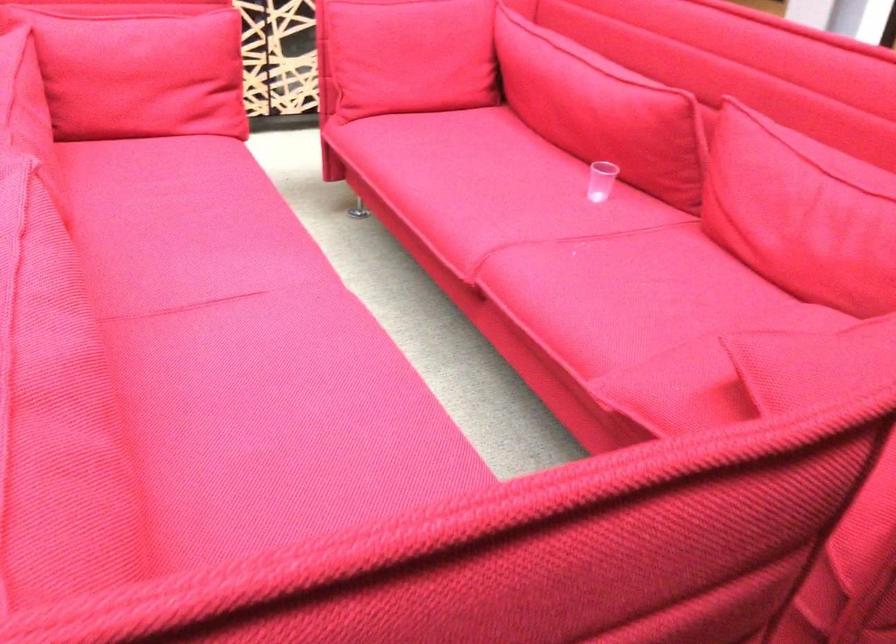
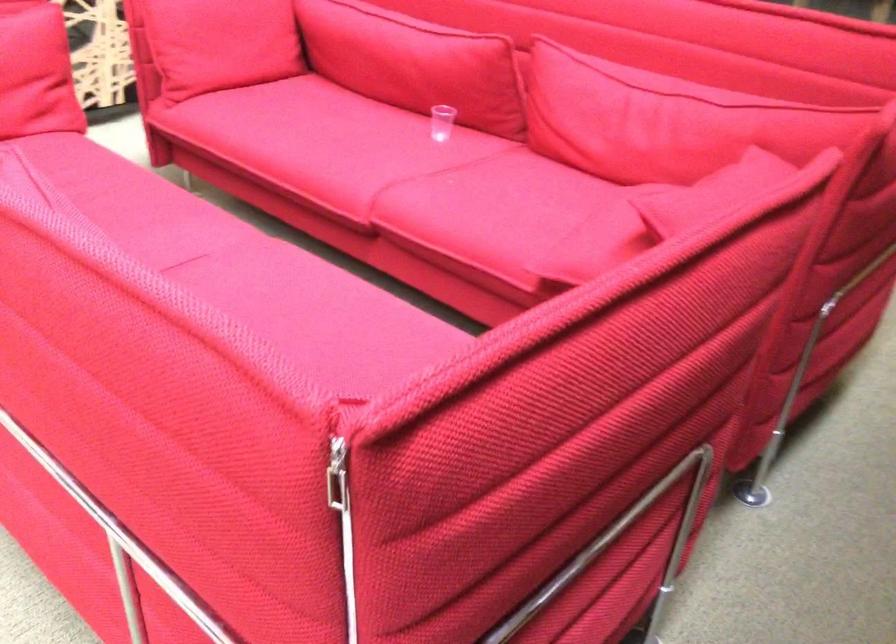
In the second image, find the point that corresponds to (x=280, y=321) in the first image.

(244, 270)